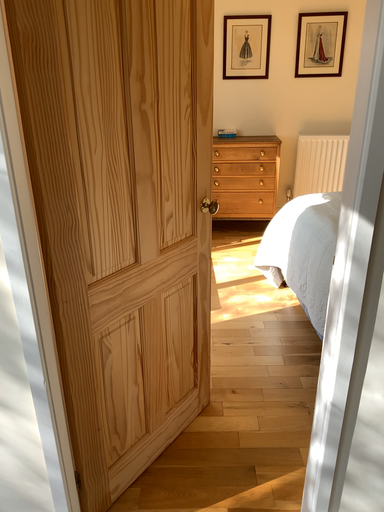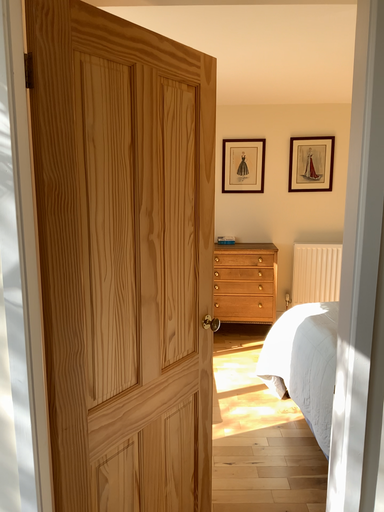
Question: How did the camera likely rotate when shooting the video?

Choices:
 (A) rotated downward
 (B) rotated upward

Answer: (B)